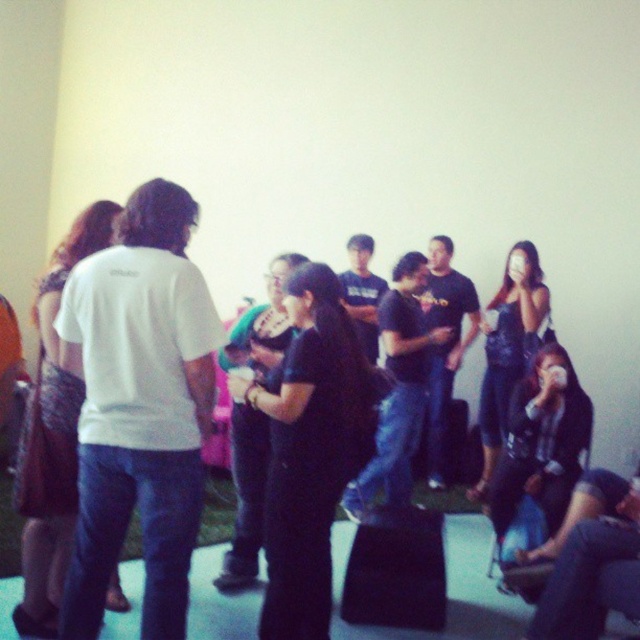
Question: Considering the relative positions of white matte t-shirt at left and black matte shirt at center in the image provided, where is white matte t-shirt at left located with respect to black matte shirt at center?

Choices:
 (A) above
 (B) below

Answer: (A)

Question: Which of the following is the farthest from the observer?

Choices:
 (A) white matte t-shirt at left
 (B) black matte shirt at center

Answer: (B)

Question: Is white matte t-shirt at left above black matte shirt at center?

Choices:
 (A) yes
 (B) no

Answer: (A)

Question: Which point appears farthest from the camera in this image?

Choices:
 (A) (124, 440)
 (B) (369, 404)

Answer: (B)

Question: Is white matte t-shirt at left to the left of black matte shirt at center from the viewer's perspective?

Choices:
 (A) no
 (B) yes

Answer: (B)